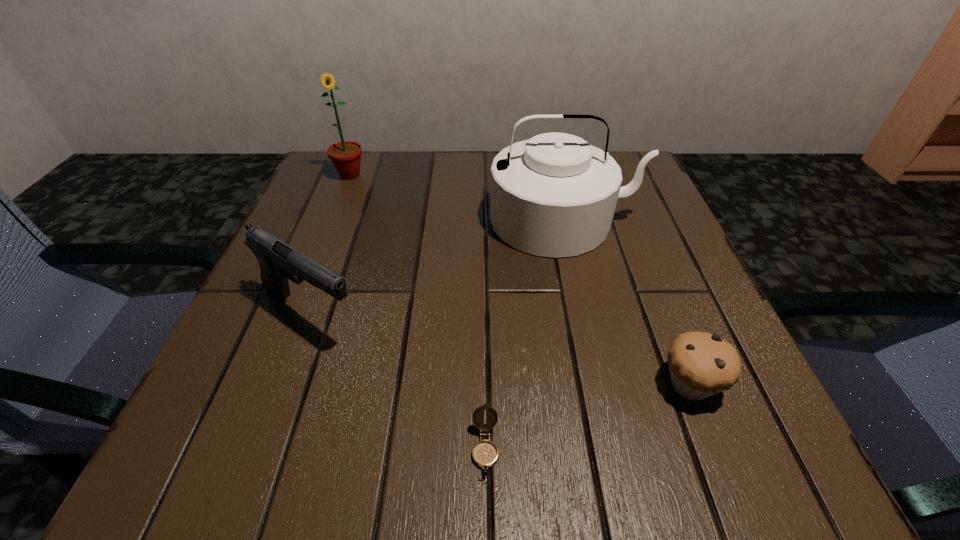
Locate an element on the screen. the farthest object is located at coordinates (346, 155).

Where is `the second farthest object`? the second farthest object is located at coordinates point(554,195).

Identify the location of gun. (278, 261).

Image resolution: width=960 pixels, height=540 pixels. Find the location of `the third nearest object`. the third nearest object is located at coordinates (278, 261).

Locate an element on the screen. the fourth tallest object is located at coordinates (701, 364).

At what (x,y) coordinates should I click in order to perform the action: click on muffin. Please return your answer as a coordinate pair (x, y). The image size is (960, 540). Looking at the image, I should click on (701, 364).

This screenshot has width=960, height=540. I want to click on the nearest object, so [x=485, y=453].

Identify the location of compass. (485, 453).

Where is `free space located 0.060m on the face of the sunflower`? This screenshot has height=540, width=960. free space located 0.060m on the face of the sunflower is located at coordinates (x=341, y=199).

This screenshot has width=960, height=540. Find the location of `vacant region located 0.210m on the spout of the kettle`. vacant region located 0.210m on the spout of the kettle is located at coordinates (594, 351).